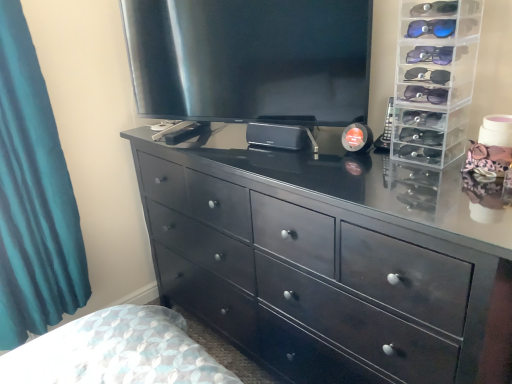
Question: Does satin black tv at upper center have a smaller size compared to teal fabric curtain at left?

Choices:
 (A) no
 (B) yes

Answer: (A)

Question: Is satin black tv at upper center at the right side of teal fabric curtain at left?

Choices:
 (A) no
 (B) yes

Answer: (B)

Question: From the image's perspective, is satin black tv at upper center below teal fabric curtain at left?

Choices:
 (A) no
 (B) yes

Answer: (A)

Question: Is satin black tv at upper center not near teal fabric curtain at left?

Choices:
 (A) yes
 (B) no

Answer: (B)

Question: Is satin black tv at upper center next to teal fabric curtain at left and touching it?

Choices:
 (A) yes
 (B) no

Answer: (B)

Question: Is point (336, 23) closer or farther from the camera than point (54, 124)?

Choices:
 (A) closer
 (B) farther

Answer: (A)

Question: Looking at the image, does satin black tv at upper center seem bigger or smaller compared to teal fabric curtain at left?

Choices:
 (A) big
 (B) small

Answer: (A)

Question: Relative to teal fabric curtain at left, is satin black tv at upper center in front or behind?

Choices:
 (A) front
 (B) behind

Answer: (B)

Question: Choose the correct answer: Is satin black tv at upper center inside teal fabric curtain at left or outside it?

Choices:
 (A) outside
 (B) inside

Answer: (A)

Question: Does point (426, 162) appear closer or farther from the camera than point (218, 211)?

Choices:
 (A) farther
 (B) closer

Answer: (B)

Question: Is clear plastic sunglasses organizer at right situated inside black wood chest of drawers at center or outside?

Choices:
 (A) inside
 (B) outside

Answer: (B)

Question: From their relative heights in the image, would you say clear plastic sunglasses organizer at right is taller or shorter than black wood chest of drawers at center?

Choices:
 (A) tall
 (B) short

Answer: (B)

Question: Considering the positions of clear plastic sunglasses organizer at right and black wood chest of drawers at center in the image, is clear plastic sunglasses organizer at right wider or thinner than black wood chest of drawers at center?

Choices:
 (A) wide
 (B) thin

Answer: (B)

Question: Considering their positions, is black wood chest of drawers at center located in front of or behind clear plastic sunglasses organizer at right?

Choices:
 (A) behind
 (B) front

Answer: (B)

Question: In terms of width, does black wood chest of drawers at center look wider or thinner when compared to clear plastic sunglasses organizer at right?

Choices:
 (A) thin
 (B) wide

Answer: (B)